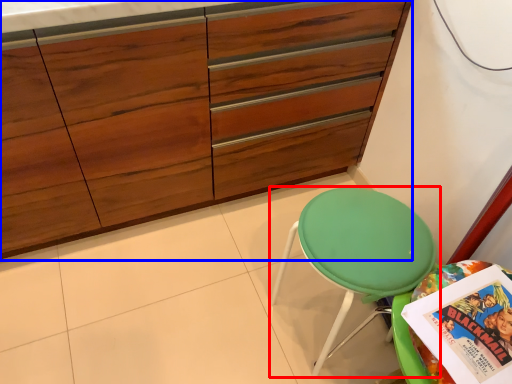
Question: Which of the following is the closest to the observer, chair (highlighted by a red box) or cabinetry (highlighted by a blue box)?

Choices:
 (A) chair
 (B) cabinetry

Answer: (B)